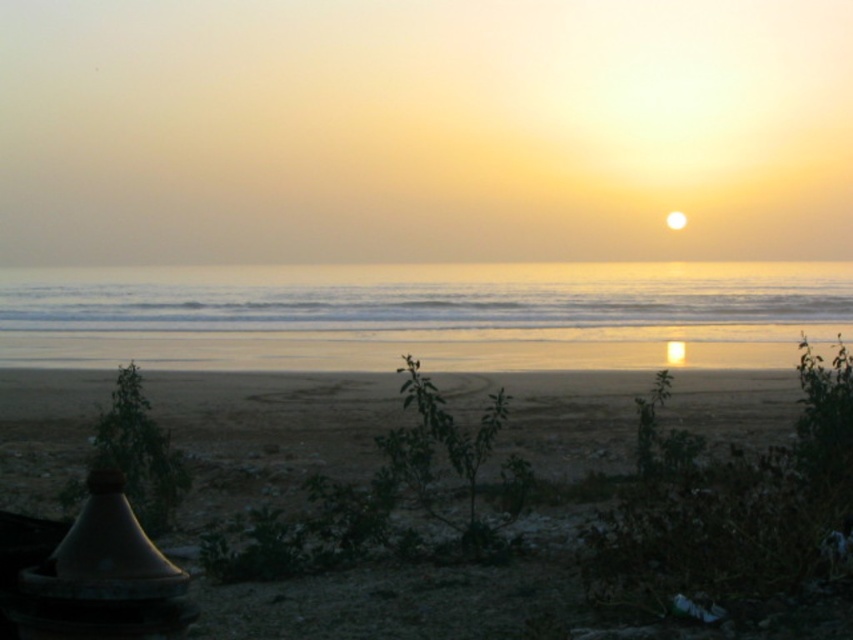
Image resolution: width=853 pixels, height=640 pixels. In order to click on sandy beach at lower center in this screenshot , I will do `click(730, 513)`.

Measure the distance between point (679, 474) and camera.

Point (679, 474) and camera are 32.44 feet apart from each other.

This screenshot has height=640, width=853. I want to click on sandy beach at lower center, so pos(730,513).